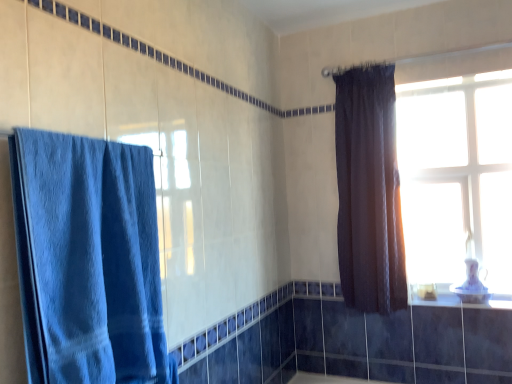
Question: Considering the positions of dark matte curtain at upper right, which is counted as the 1th curtain, starting from the right, and porcelain white window sill at lower right in the image, is dark matte curtain at upper right, which is counted as the 1th curtain, starting from the right, wider or thinner than porcelain white window sill at lower right?

Choices:
 (A) wide
 (B) thin

Answer: (B)

Question: From a real-world perspective, relative to porcelain white window sill at lower right, is dark matte curtain at upper right, which is counted as the second curtain, starting from the left, vertically above or below?

Choices:
 (A) above
 (B) below

Answer: (A)

Question: Which object is the closest to the dark matte curtain at upper right, which is counted as the 2th curtain, starting from the front?

Choices:
 (A) blue towel at left, arranged as the second curtain when viewed from the back
 (B) white glossy sink at upper right
 (C) transparent glass window at upper right
 (D) porcelain white window sill at lower right

Answer: (C)

Question: Which of these objects is positioned farthest from the dark matte curtain at upper right, placed as the first curtain when sorted from back to front?

Choices:
 (A) blue towel at left, acting as the second curtain starting from the right
 (B) white glossy sink at upper right
 (C) transparent glass window at upper right
 (D) porcelain white window sill at lower right

Answer: (A)